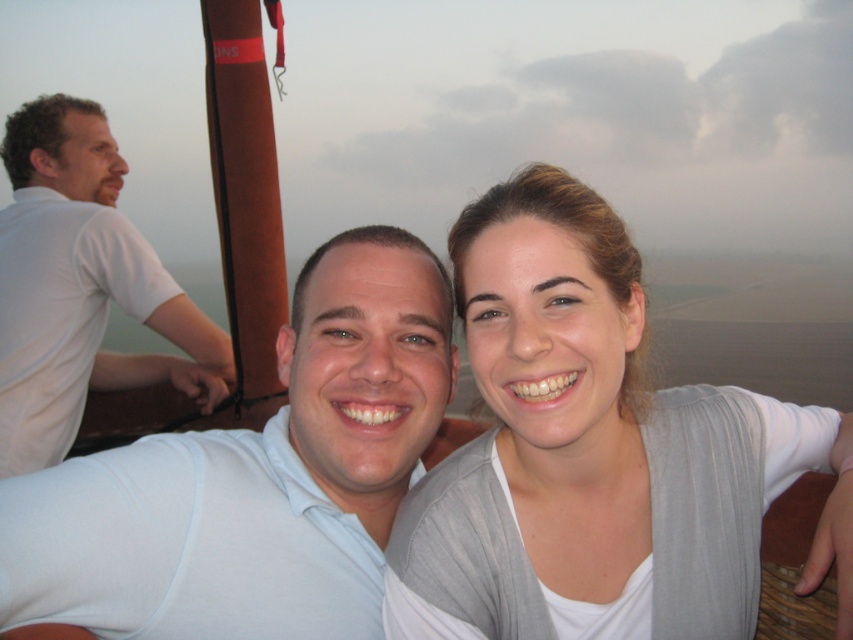
Does white matte shirt at center lie behind white cotton shirt at left?

No, white matte shirt at center is closer to the viewer.

Which is more to the left, white matte shirt at center or white cotton shirt at left?

white cotton shirt at left

Is point (10, 484) closer to camera compared to point (54, 316)?

Yes.

Where is `white matte shirt at center`? white matte shirt at center is located at coordinates (257, 476).

Is light gray knit cardigan at center below white matte shirt at center?

Actually, light gray knit cardigan at center is above white matte shirt at center.

Is point (646, 598) in front of point (273, 417)?

Yes, point (646, 598) is closer to viewer.

Identify the location of light gray knit cardigan at center. (581, 451).

Is light gray knit cardigan at center smaller than white cotton shirt at left?

Correct, light gray knit cardigan at center occupies less space than white cotton shirt at left.

Is light gray knit cardigan at center in front of white cotton shirt at left?

Yes, it is.

Find the location of a particular element. The height and width of the screenshot is (640, 853). light gray knit cardigan at center is located at coordinates (581, 451).